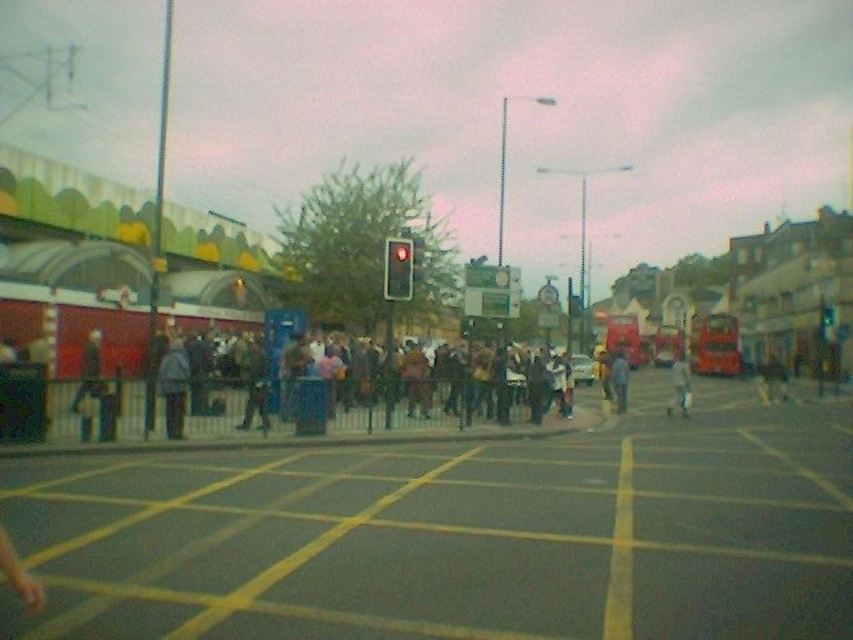
Question: Which object is farther from the camera taking this photo?

Choices:
 (A) light gray jacket at center
 (B) red metallic bus at center

Answer: (B)

Question: Is brown fabric crowd at center further to the viewer compared to light gray jacket at center?

Choices:
 (A) no
 (B) yes

Answer: (A)

Question: Can you confirm if red metallic bus at center is smaller than red glass traffic light at center?

Choices:
 (A) yes
 (B) no

Answer: (B)

Question: Estimate the real-world distances between objects in this image. Which object is farther from the brown fabric crowd at center?

Choices:
 (A) light gray jacket at center
 (B) dark gray jacket at center

Answer: (A)

Question: Considering the real-world distances, which object is closest to the light gray jacket at center?

Choices:
 (A) dark blue jacket at center
 (B) red glass traffic light at center

Answer: (A)

Question: Can you confirm if dark gray jacket at center is thinner than light gray jacket at center?

Choices:
 (A) no
 (B) yes

Answer: (B)